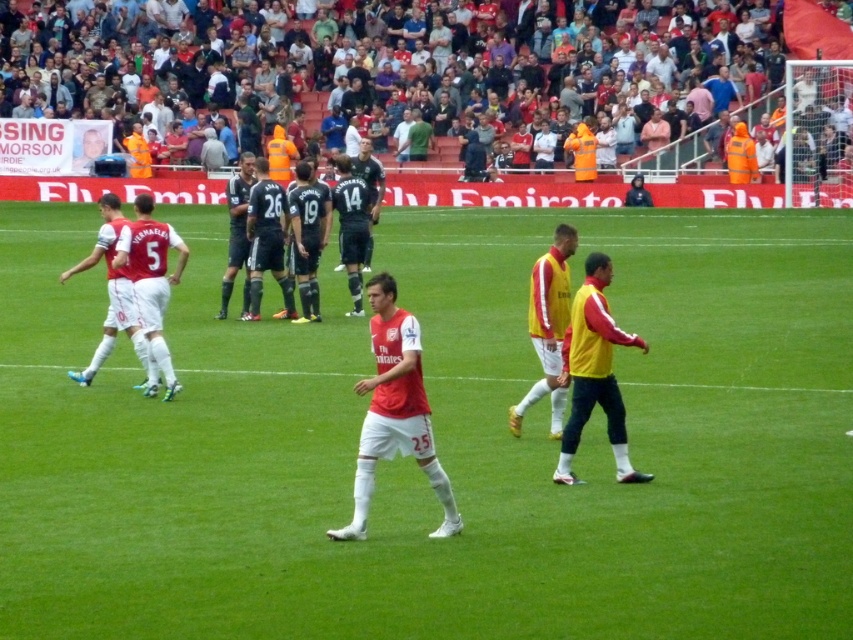
You are a soccer referee standing at the edge of the field. You need to determine if the two players wearing the matte red jersey at center and the white matte jersey at left are within the required 15 feet distance for a legal play. Based on the scene, can you confirm if their distance is legal?

The matte red jersey at center and white matte jersey at left are 14.34 feet apart, which is within the required 15 feet distance for a legal play. Therefore, their distance is legal.